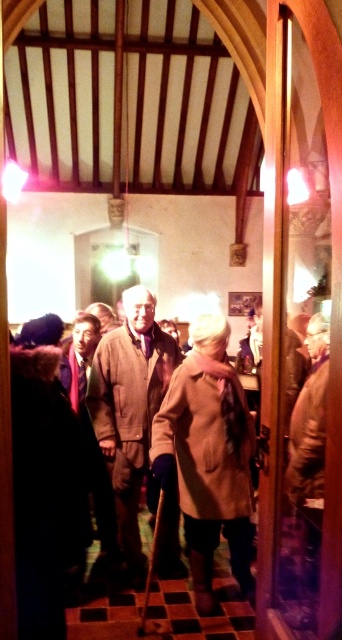
Question: Can you confirm if beige woolen trench coat at center is smaller than beige wool coat at center?

Choices:
 (A) no
 (B) yes

Answer: (A)

Question: Which object appears closest to the camera in this image?

Choices:
 (A) beige woolen trench coat at center
 (B) beige wool coat at center

Answer: (A)

Question: Does beige woolen trench coat at center appear over beige wool coat at center?

Choices:
 (A) no
 (B) yes

Answer: (A)

Question: Which point appears closest to the camera in this image?

Choices:
 (A) (193, 436)
 (B) (138, 412)

Answer: (A)

Question: Does beige woolen trench coat at center lie behind beige wool coat at center?

Choices:
 (A) yes
 (B) no

Answer: (B)